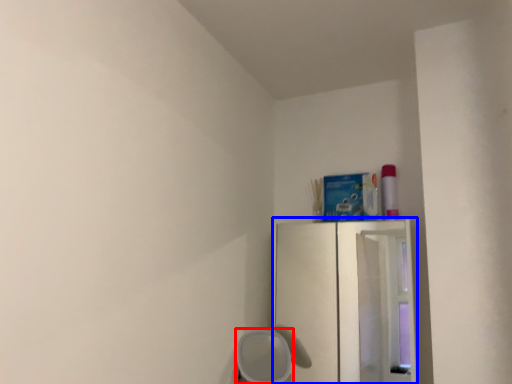
Question: Among these objects, which one is nearest to the camera, furniture (highlighted by a red box) or fridge (highlighted by a blue box)?

Choices:
 (A) furniture
 (B) fridge

Answer: (A)